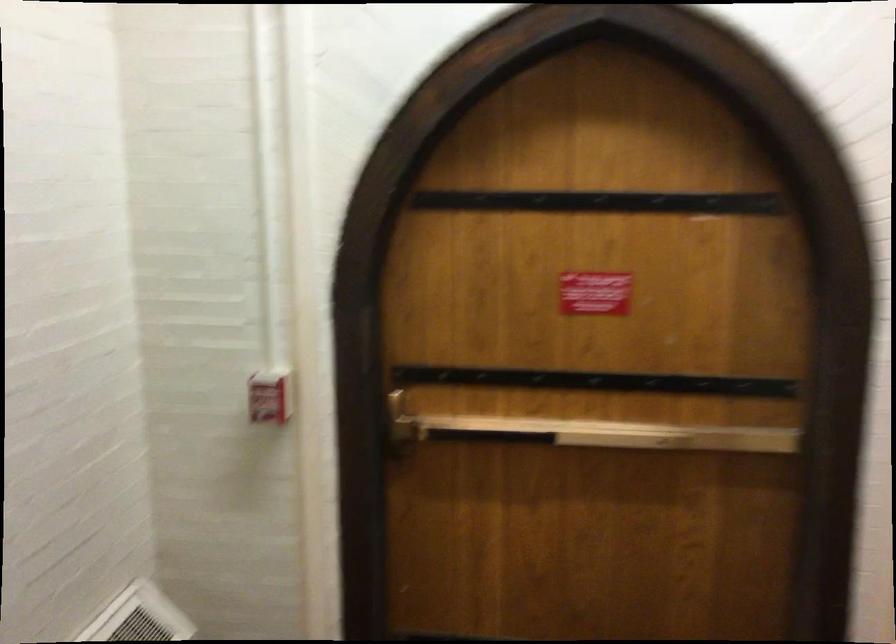
Where would you push the door panic bar? Please return your answer as a coordinate pair (x, y).

(595, 433)